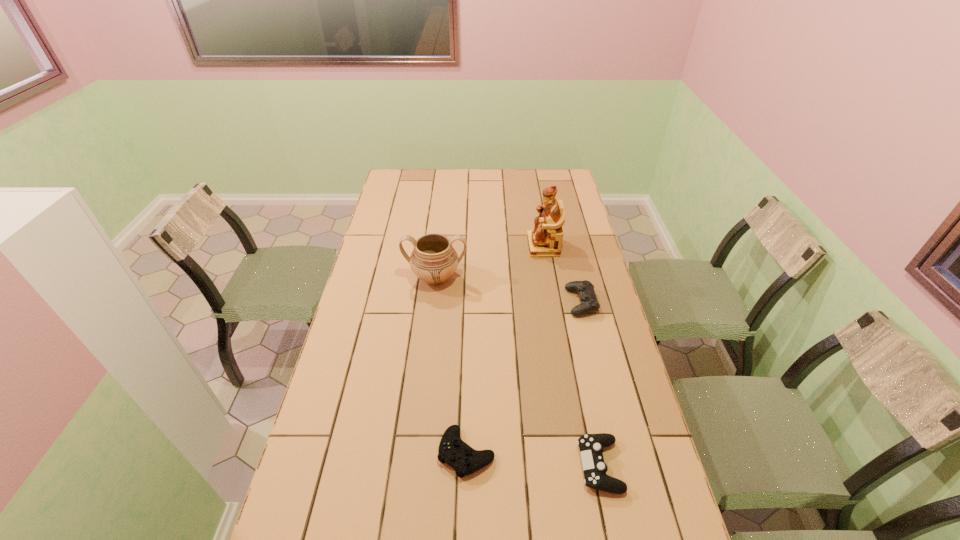
At what (x,y) coordinates should I click in order to perform the action: click on vacant area that satisfies the following two spatial constraints: 1. on the front-facing side of the figurine; 2. on the front-facing side of the second tallest object. Please return your answer as a coordinate pair (x, y). Image resolution: width=960 pixels, height=540 pixels. Looking at the image, I should click on (548, 278).